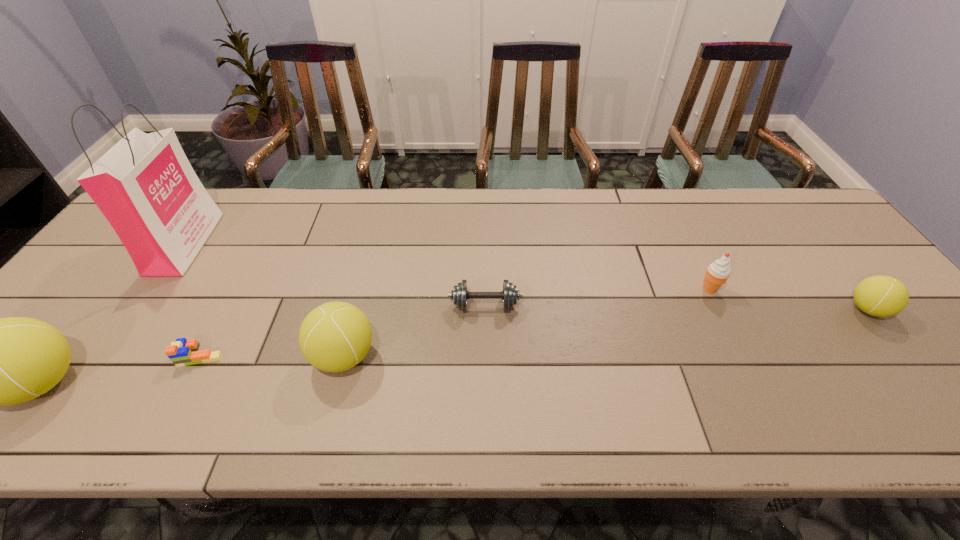
Where is `the second tennis ball from right to left`? The height and width of the screenshot is (540, 960). the second tennis ball from right to left is located at coordinates (334, 337).

Where is `the fourth object from left to right`? the fourth object from left to right is located at coordinates [334, 337].

Identify the location of the farthest tennis ball. The width and height of the screenshot is (960, 540). (881, 296).

The height and width of the screenshot is (540, 960). I want to click on the rightmost tennis ball, so click(x=881, y=296).

The image size is (960, 540). Find the location of `the tallest object`. the tallest object is located at coordinates (145, 186).

This screenshot has width=960, height=540. I want to click on the farthest object, so click(145, 186).

At what (x,y) coordinates should I click in order to perform the action: click on the second shortest object. Please return your answer as a coordinate pair (x, y). This screenshot has height=540, width=960. Looking at the image, I should click on (510, 294).

At what (x,y) coordinates should I click in order to perform the action: click on dumbbell. Please return your answer as a coordinate pair (x, y). This screenshot has width=960, height=540. Looking at the image, I should click on (510, 294).

This screenshot has height=540, width=960. What are the coordinates of `icecream` in the screenshot? It's located at (717, 273).

At what (x,y) coordinates should I click in order to perform the action: click on the fourth tallest object. Please return your answer as a coordinate pair (x, y). This screenshot has width=960, height=540. Looking at the image, I should click on (717, 273).